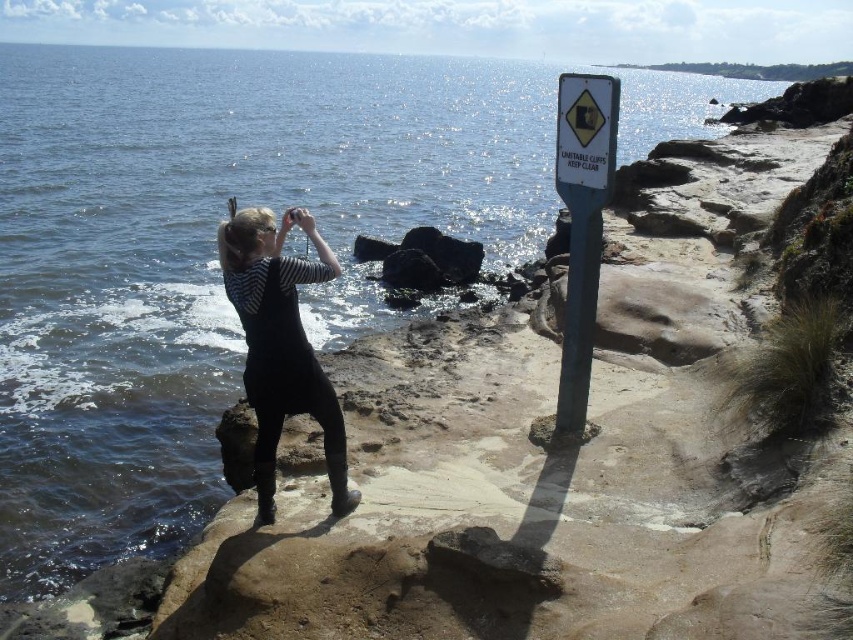
Question: Which of the following is the farthest from the observer?

Choices:
 (A) black matte wetsuit at center
 (B) metallic pole at center-right
 (C) blue plastic sign at right

Answer: (B)

Question: Does blue plastic sign at right appear under black matte wetsuit at center?

Choices:
 (A) no
 (B) yes

Answer: (A)

Question: Which point appears closest to the camera in this image?

Choices:
 (A) (613, 100)
 (B) (579, 433)
 (C) (276, 413)

Answer: (C)

Question: Estimate the real-world distances between objects in this image. Which object is closer to the black matte wetsuit at center?

Choices:
 (A) blue plastic sign at right
 (B) metallic pole at center-right

Answer: (B)

Question: Does black matte wetsuit at center have a lesser width compared to metallic pole at center-right?

Choices:
 (A) yes
 (B) no

Answer: (B)

Question: Is the position of blue plastic sign at right more distant than that of metallic pole at center-right?

Choices:
 (A) no
 (B) yes

Answer: (A)